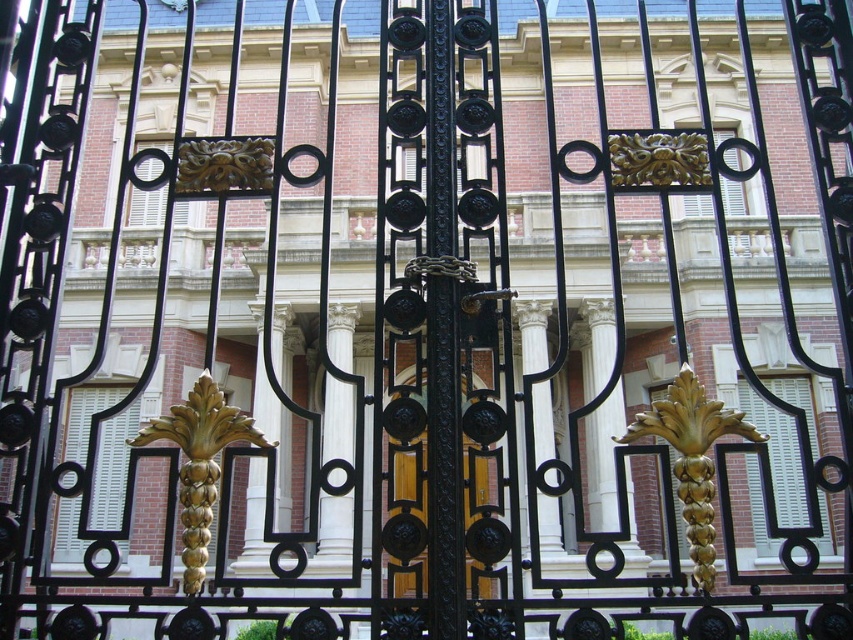
Consider the image. Between goldmetallicornament at center and wooden door at center, which one has less height?

With less height is goldmetallicornament at center.

What do you see at coordinates (692, 458) in the screenshot? The height and width of the screenshot is (640, 853). I see `goldmetallicornament at center` at bounding box center [692, 458].

At what (x,y) coordinates should I click in order to perform the action: click on goldmetallicornament at center. Please return your answer as a coordinate pair (x, y). The width and height of the screenshot is (853, 640). Looking at the image, I should click on (692, 458).